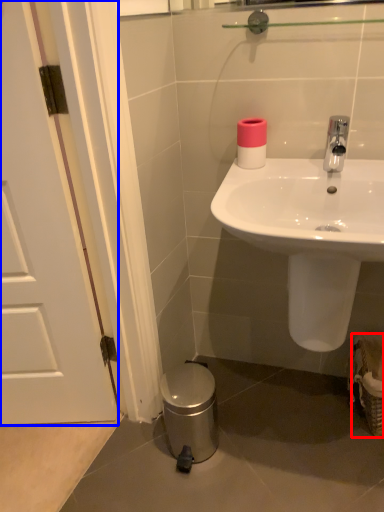
Question: Among these objects, which one is nearest to the camera, basket (highlighted by a red box) or door (highlighted by a blue box)?

Choices:
 (A) basket
 (B) door

Answer: (B)